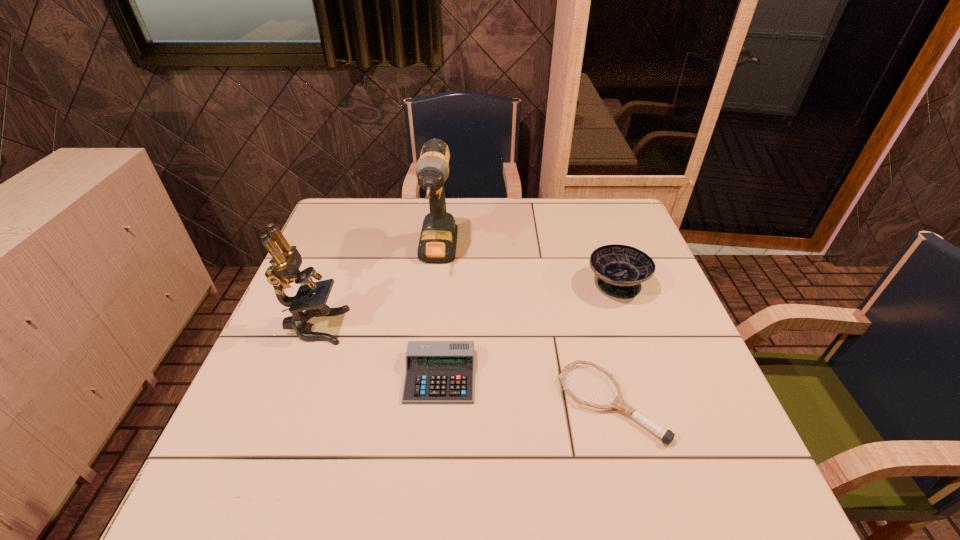
Where is `free location that satisfies the following two spatial constraints: 1. on the back side of the shortest object; 2. at the eyepieces of the third farthest object`? The height and width of the screenshot is (540, 960). free location that satisfies the following two spatial constraints: 1. on the back side of the shortest object; 2. at the eyepieces of the third farthest object is located at coordinates (590, 326).

Locate an element on the screen. Image resolution: width=960 pixels, height=540 pixels. free space that satisfies the following two spatial constraints: 1. with the drill bit of the drill facing forward; 2. at the eyepieces of the leftmost object is located at coordinates (429, 326).

Find the location of `vacant area that satisfies the following two spatial constraints: 1. on the back side of the bowl; 2. on the right side of the shortest object`. vacant area that satisfies the following two spatial constraints: 1. on the back side of the bowl; 2. on the right side of the shortest object is located at coordinates (580, 284).

The height and width of the screenshot is (540, 960). I want to click on free space that satisfies the following two spatial constraints: 1. on the back side of the calculator; 2. on the right side of the bowl, so click(447, 284).

You are a GUI agent. You are given a task and a screenshot of the screen. Output one action in this format:
    pyautogui.click(x=<x>, y=<y>)
    Task: Click on the vacant area that satisfies the following two spatial constraints: 1. with the drill bit of the drill facing forward; 2. at the eyepieces of the third nearest object
    
    Given the screenshot: What is the action you would take?
    pyautogui.click(x=429, y=326)

Locate an element on the screen. This screenshot has width=960, height=540. vacant region that satisfies the following two spatial constraints: 1. with the drill bit of the fourth tallest object facing forward; 2. on the left side of the drill is located at coordinates (423, 376).

This screenshot has height=540, width=960. In order to click on free space in the image that satisfies the following two spatial constraints: 1. with the drill bit of the third shortest object facing forward; 2. on the right side of the drill in this screenshot , I will do `click(435, 284)`.

Locate an element on the screen. Image resolution: width=960 pixels, height=540 pixels. free spot that satisfies the following two spatial constraints: 1. with the drill bit of the third shortest object facing forward; 2. on the left side of the drill is located at coordinates (435, 284).

The image size is (960, 540). Find the location of `vacant space that satisfies the following two spatial constraints: 1. at the eyepieces of the third farthest object; 2. on the right side of the fourth tallest object`. vacant space that satisfies the following two spatial constraints: 1. at the eyepieces of the third farthest object; 2. on the right side of the fourth tallest object is located at coordinates (295, 376).

Locate an element on the screen. free location that satisfies the following two spatial constraints: 1. on the back side of the second shortest object; 2. at the eyepieces of the microscope is located at coordinates coord(444,326).